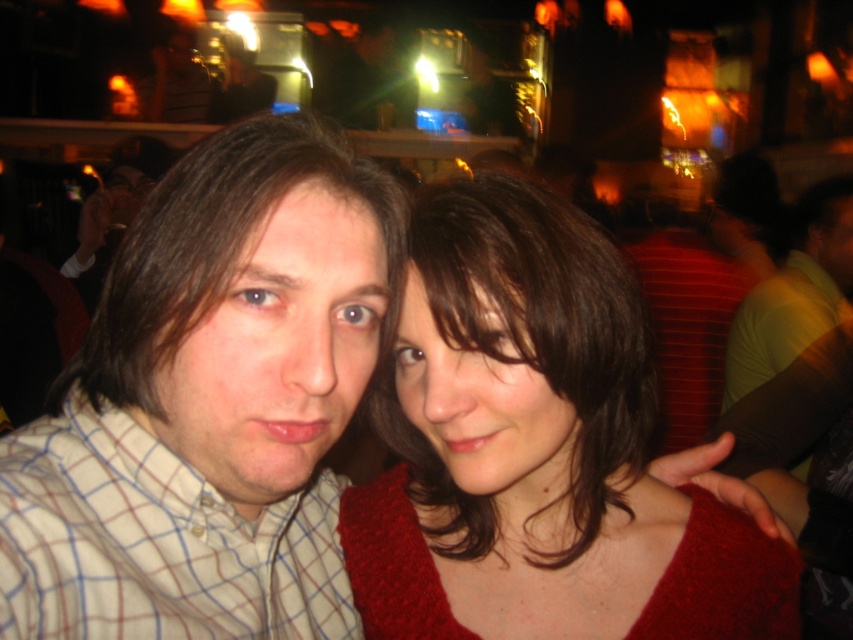
Question: Which point is closer to the camera?

Choices:
 (A) plaid cotton shirt at left
 (B) green matte shirt at right
 (C) matte red sweater at center
 (D) plaid shirt at center

Answer: (A)

Question: Which of the following is the farthest from the observer?

Choices:
 (A) plaid cotton shirt at left
 (B) plaid shirt at center
 (C) matte red sweater at center
 (D) green matte shirt at right

Answer: (D)

Question: Among these points, which one is nearest to the camera?

Choices:
 (A) (155, 364)
 (B) (514, 636)
 (C) (68, 570)

Answer: (C)

Question: Is plaid shirt at center bigger than plaid cotton shirt at left?

Choices:
 (A) yes
 (B) no

Answer: (A)

Question: Where is matte red sweater at center located in relation to plaid cotton shirt at left in the image?

Choices:
 (A) below
 (B) above

Answer: (B)

Question: Is matte red sweater at center thinner than plaid cotton shirt at left?

Choices:
 (A) yes
 (B) no

Answer: (B)